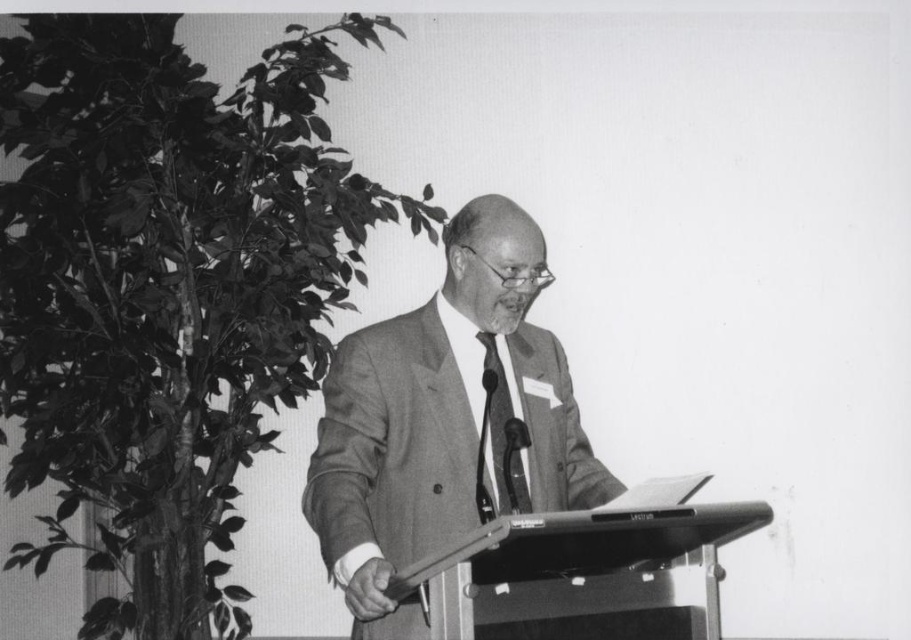
You are a photographer standing at a distance of 2 meters from the matte black tie at center. You want to take a closeup photo of the camera. Will you need to move closer or farther away?

The matte black tie at center and camera are 1.79 meters apart. Since you are currently 2 meters away from the matte black tie at center, you need to move closer to the camera to get a closeup.

Based on the scene description, where is the smooth gray suit at center located in the image?

The smooth gray suit at center is located at point (444,419).